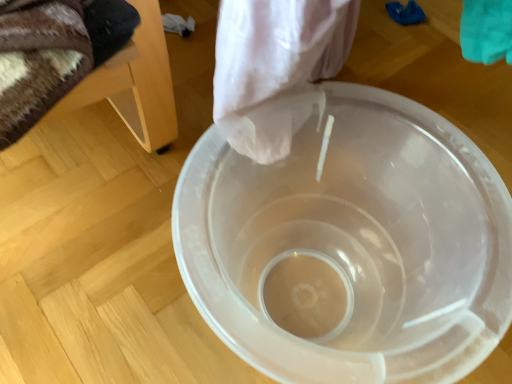
The width and height of the screenshot is (512, 384). What are the coordinates of `vacant space situated on the left part of transparent plastic bucket at center` in the screenshot? It's located at (104, 256).